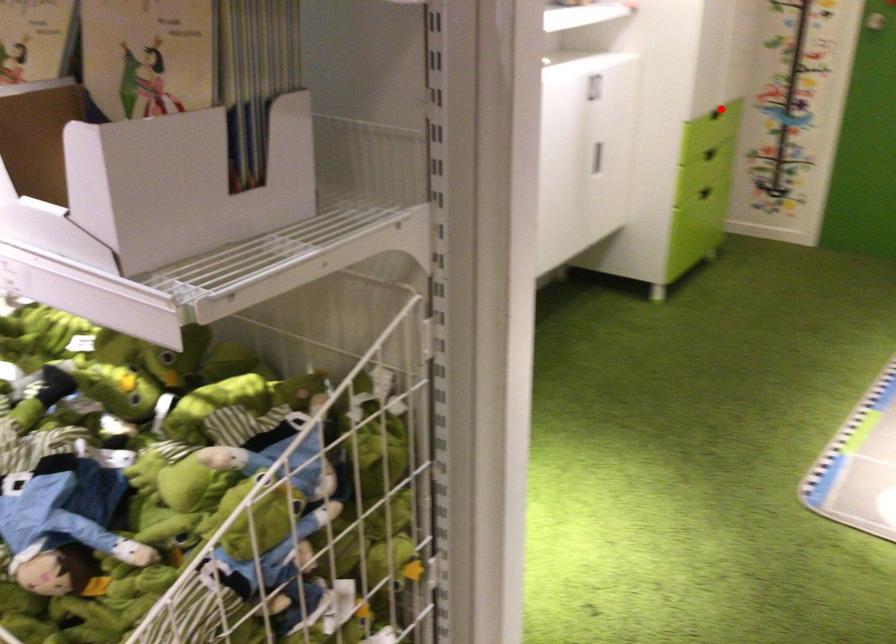
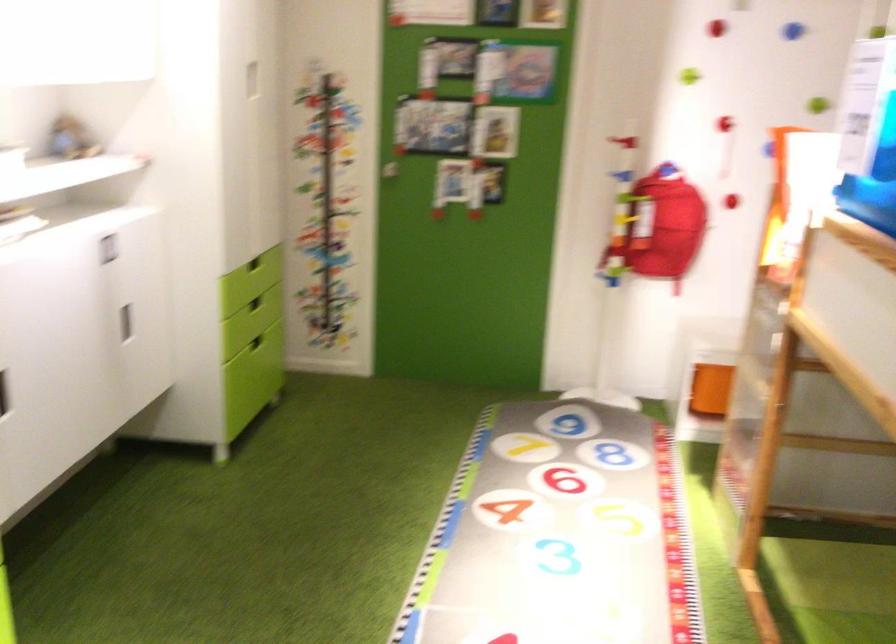
The point at the highlighted location is marked in the first image. Where is the corresponding point in the second image?

(254, 263)